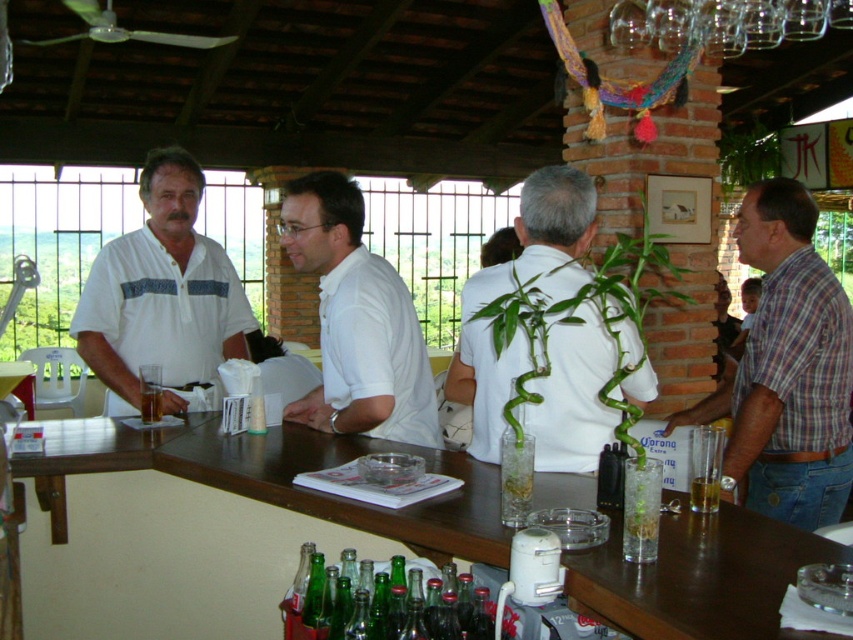
Is white matte shirt at center thinner than green glass bottles at center?

Yes.

Which is above, white matte shirt at center or green glass bottles at center?

white matte shirt at center

This screenshot has height=640, width=853. What do you see at coordinates (357, 321) in the screenshot? I see `white matte shirt at center` at bounding box center [357, 321].

The height and width of the screenshot is (640, 853). I want to click on white matte shirt at center, so click(x=357, y=321).

Which is more to the right, white matte shirt at center or translucent glass beer at bar center?

From the viewer's perspective, translucent glass beer at bar center appears more on the right side.

Does white matte shirt at center appear over translucent glass beer at bar center?

Indeed, white matte shirt at center is positioned over translucent glass beer at bar center.

Is point (283, 417) closer to camera compared to point (698, 490)?

No, (283, 417) is further to viewer.

This screenshot has height=640, width=853. I want to click on white matte shirt at center, so pos(357,321).

Which is above, white matte shirt at center or translucent glass beverage at bar front?

white matte shirt at center is higher up.

Is white matte shirt at center bigger than translucent glass beverage at bar front?

Correct, white matte shirt at center is larger in size than translucent glass beverage at bar front.

Who is more forward, (318, 218) or (143, 392)?

Point (318, 218) is more forward.

This screenshot has width=853, height=640. Identify the location of white matte shirt at center. (357, 321).